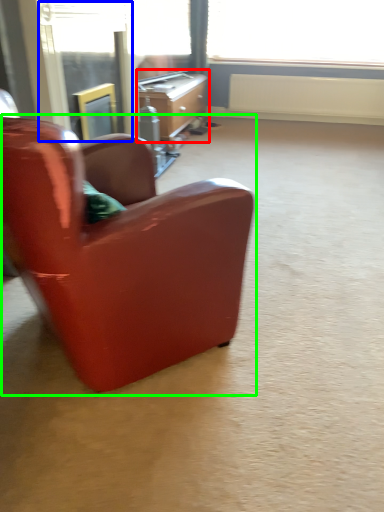
Question: Estimate the real-world distances between objects in this image. Which object is farther from desk (highlighted by a red box), screen door (highlighted by a blue box) or chair (highlighted by a green box)?

Choices:
 (A) screen door
 (B) chair

Answer: (B)